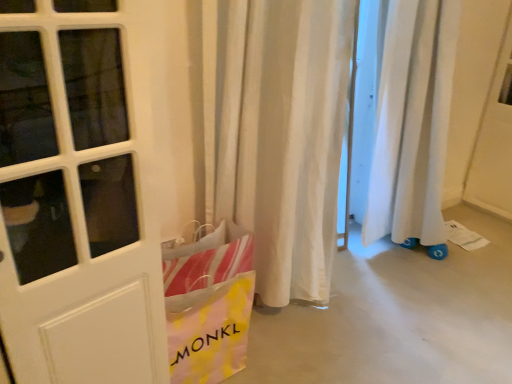
Question: Is white fabric curtain at center to the left or to the right of yellow and pink plastic bag at lower left in the image?

Choices:
 (A) right
 (B) left

Answer: (A)

Question: From their relative heights in the image, would you say white fabric curtain at center is taller or shorter than yellow and pink plastic bag at lower left?

Choices:
 (A) tall
 (B) short

Answer: (A)

Question: Do you think white fabric curtain at center is within yellow and pink plastic bag at lower left, or outside of it?

Choices:
 (A) outside
 (B) inside

Answer: (A)

Question: Is yellow and pink plastic bag at lower left taller or shorter than white fabric curtain at center?

Choices:
 (A) tall
 (B) short

Answer: (B)

Question: In terms of size, does yellow and pink plastic bag at lower left appear bigger or smaller than white fabric curtain at center?

Choices:
 (A) big
 (B) small

Answer: (B)

Question: Considering the positions of yellow and pink plastic bag at lower left and white fabric curtain at center in the image, is yellow and pink plastic bag at lower left wider or thinner than white fabric curtain at center?

Choices:
 (A) wide
 (B) thin

Answer: (B)

Question: Considering their positions, is yellow and pink plastic bag at lower left located in front of or behind white fabric curtain at center?

Choices:
 (A) front
 (B) behind

Answer: (B)